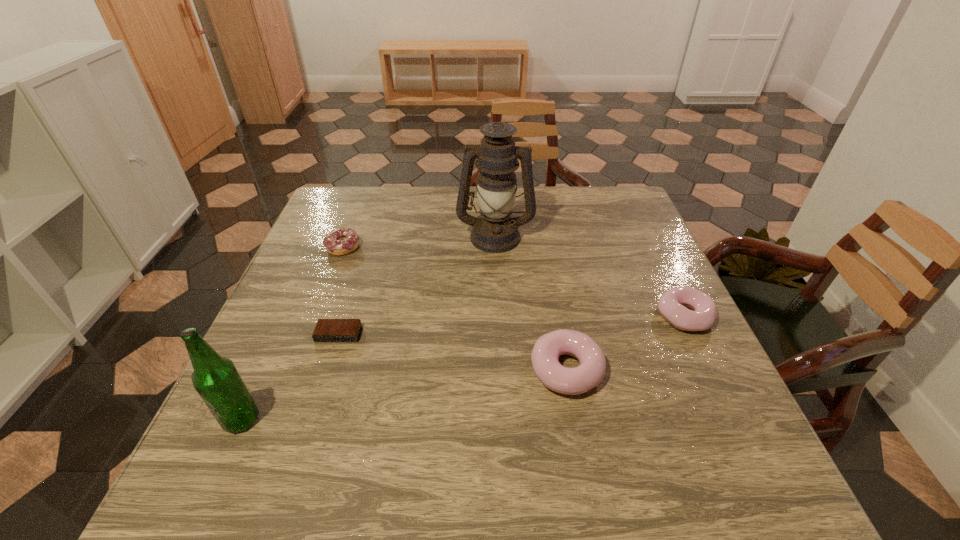
Find the location of a particular element. The height and width of the screenshot is (540, 960). the second doughnut from left to right is located at coordinates (590, 372).

This screenshot has width=960, height=540. Find the location of `the nearest doughnut`. the nearest doughnut is located at coordinates (590, 372).

Find the location of `the rightmost object`. the rightmost object is located at coordinates (672, 304).

The image size is (960, 540). Find the location of `the rightmost doughnut`. the rightmost doughnut is located at coordinates (672, 304).

In order to click on oil lamp in this screenshot , I will do `click(495, 231)`.

This screenshot has width=960, height=540. Find the location of `alarm clock`. alarm clock is located at coordinates (326, 330).

You are a GUI agent. You are given a task and a screenshot of the screen. Output one action in this format:
    pyautogui.click(x=<x>, y=<y>)
    Task: Click on the farthest doughnut
    
    Given the screenshot: What is the action you would take?
    [341, 241]

At what (x,y) coordinates should I click in order to perform the action: click on the shortest doughnut. Please return your answer as a coordinate pair (x, y). The image size is (960, 540). Looking at the image, I should click on (341, 241).

Where is `the nearest object`? the nearest object is located at coordinates (216, 379).

Locate an element on the screen. the fifth shortest object is located at coordinates (216, 379).